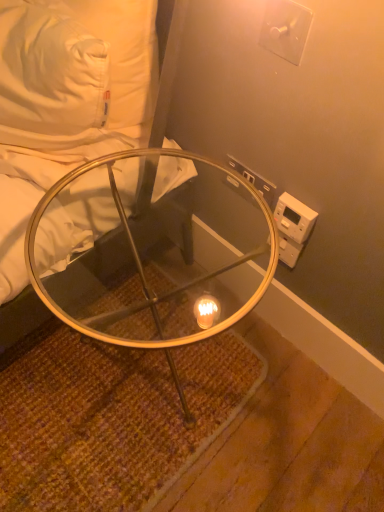
Question: Does white plastic switch at upper right, which is the second electric outlet from back to front, have a lesser width compared to clear glass table at lower left?

Choices:
 (A) yes
 (B) no

Answer: (A)

Question: From the image's perspective, is white plastic switch at upper right, the first electric outlet when ordered from top to bottom, located above clear glass table at lower left?

Choices:
 (A) no
 (B) yes

Answer: (A)

Question: Is the depth of white plastic switch at upper right, the first electric outlet when ordered from front to back, less than that of clear glass table at lower left?

Choices:
 (A) no
 (B) yes

Answer: (A)

Question: From a real-world perspective, is white plastic switch at upper right, marked as the 2th electric outlet in a bottom-to-top arrangement, under clear glass table at lower left?

Choices:
 (A) no
 (B) yes

Answer: (A)

Question: From the image's perspective, is white plastic switch at upper right, the first electric outlet when ordered from top to bottom, positioned above or below white plastic electrical outlet at upper right, which is the second electric outlet in front-to-back order?

Choices:
 (A) below
 (B) above

Answer: (B)

Question: From a real-world perspective, is white plastic switch at upper right, the first electric outlet when ordered from front to back, positioned above or below white plastic electrical outlet at upper right, positioned as the second electric outlet in top-to-bottom order?

Choices:
 (A) below
 (B) above

Answer: (B)

Question: From their relative heights in the image, would you say white plastic switch at upper right, the first electric outlet when ordered from front to back, is taller or shorter than white plastic electrical outlet at upper right, the 1th electric outlet from the back?

Choices:
 (A) tall
 (B) short

Answer: (A)

Question: In terms of size, does white plastic switch at upper right, the first electric outlet when ordered from front to back, appear bigger or smaller than white plastic electrical outlet at upper right, which is the second electric outlet in front-to-back order?

Choices:
 (A) big
 (B) small

Answer: (A)

Question: Considering their positions, is white plastic electrical outlet at upper right, the 1th electric outlet from the back, located in front of or behind white plastic switch at upper right, the first electric outlet when ordered from front to back?

Choices:
 (A) behind
 (B) front

Answer: (A)

Question: Considering the positions of white plastic electrical outlet at upper right, positioned as the second electric outlet in top-to-bottom order, and white plastic switch at upper right, the first electric outlet when ordered from front to back, in the image, is white plastic electrical outlet at upper right, positioned as the second electric outlet in top-to-bottom order, taller or shorter than white plastic switch at upper right, the first electric outlet when ordered from front to back,?

Choices:
 (A) tall
 (B) short

Answer: (B)

Question: From a real-world perspective, is white plastic electrical outlet at upper right, the 1th electric outlet from the back, above or below white plastic switch at upper right, the first electric outlet when ordered from top to bottom?

Choices:
 (A) below
 (B) above

Answer: (A)

Question: Is white plastic electrical outlet at upper right, positioned as the first electric outlet in bottom-to-top order, situated inside white plastic switch at upper right, the first electric outlet when ordered from front to back, or outside?

Choices:
 (A) inside
 (B) outside

Answer: (B)

Question: From their relative heights in the image, would you say clear glass table at center is taller or shorter than white plastic electrical outlet at upper right, which is the second electric outlet in front-to-back order?

Choices:
 (A) tall
 (B) short

Answer: (A)

Question: In terms of width, does clear glass table at center look wider or thinner when compared to white plastic electrical outlet at upper right, positioned as the second electric outlet in top-to-bottom order?

Choices:
 (A) thin
 (B) wide

Answer: (B)